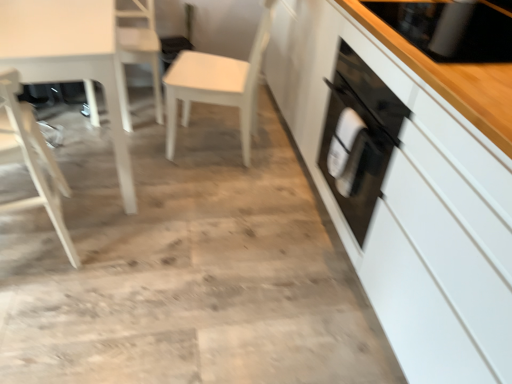
Locate an element on the screen. The width and height of the screenshot is (512, 384). spots to the right of white glossy table at left is located at coordinates tap(192, 206).